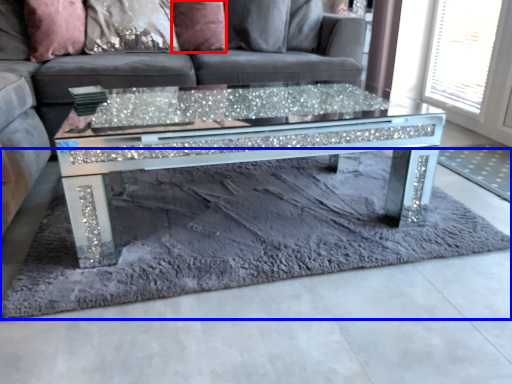
Question: Which point is closer to the camera, pillow (highlighted by a red box) or mat (highlighted by a blue box)?

Choices:
 (A) pillow
 (B) mat

Answer: (B)